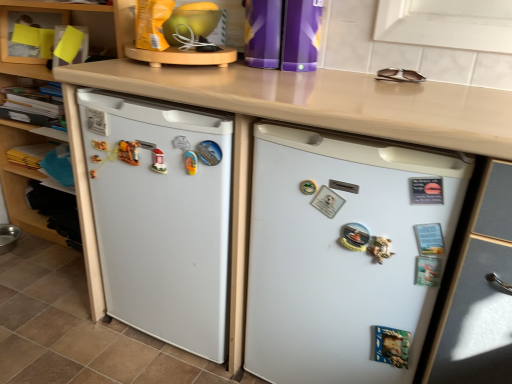
Measure the distance between point [12,194] and camera.

The distance of point [12,194] from camera is 6.34 feet.

Find the location of `white matte refrigerator at left`. white matte refrigerator at left is located at coordinates (20, 183).

The image size is (512, 384). What do you see at coordinates (20, 183) in the screenshot? I see `white matte refrigerator at left` at bounding box center [20, 183].

Locate an element on the screen. The image size is (512, 384). white matte refrigerator at center, which appears as the 2th refrigerator when viewed from the left is located at coordinates (344, 253).

Measure the distance from white matte refrigerator at left to yellow paper at upper left, arranged as the first shelf when viewed from the top.

white matte refrigerator at left and yellow paper at upper left, arranged as the first shelf when viewed from the top, are 6.97 inches apart.

Is white matte refrigerator at left positioned beyond the bounds of yellow paper at upper left, arranged as the first shelf when viewed from the top?

Yes, white matte refrigerator at left is not within yellow paper at upper left, arranged as the first shelf when viewed from the top.

What's the angular difference between white matte refrigerator at left and yellow paper at upper left, the 2th shelf ordered from the bottom,'s facing directions?

They differ by 23.4 degrees in their facing directions.

Is point (87, 254) closer to viewer compared to point (38, 58)?

Yes.

Can you tell me how much white matte refrigerator at left and wooden shelf at lower left, the 2th shelf from the top, differ in facing direction?

There is a 3.45-degree angle between the facing directions of white matte refrigerator at left and wooden shelf at lower left, the 2th shelf from the top.

Which is more to the right, white matte refrigerator at left or wooden shelf at lower left, the 2th shelf from the top?

Positioned to the right is white matte refrigerator at left.

Considering the relative positions of white matte refrigerator at left and wooden shelf at lower left, which is the first shelf in bottom-to-top order, in the image provided, is white matte refrigerator at left behind wooden shelf at lower left, which is the first shelf in bottom-to-top order,?

That is False.

Can you confirm if white matte refrigerator at left is thinner than wooden shelf at lower left, which is the first shelf in bottom-to-top order?

Incorrect, the width of white matte refrigerator at left is not less than that of wooden shelf at lower left, which is the first shelf in bottom-to-top order.

From a real-world perspective, does yellow paper at upper left, the 2th shelf ordered from the bottom, stand above white matte refrigerator at center, which appears as the 2th refrigerator when viewed from the left?

Indeed, from a real-world perspective, yellow paper at upper left, the 2th shelf ordered from the bottom, stands above white matte refrigerator at center, which appears as the 2th refrigerator when viewed from the left.

In the scene shown: Which of these two, yellow paper at upper left, arranged as the first shelf when viewed from the top, or white matte refrigerator at center, acting as the 1th refrigerator starting from the right, is smaller?

yellow paper at upper left, arranged as the first shelf when viewed from the top.

Can you confirm if yellow paper at upper left, the 2th shelf ordered from the bottom, is taller than white matte refrigerator at center, which appears as the 2th refrigerator when viewed from the left?

Incorrect, the height of yellow paper at upper left, the 2th shelf ordered from the bottom, is not larger of that of white matte refrigerator at center, which appears as the 2th refrigerator when viewed from the left.

Between white matte refrigerator at left, which is the second refrigerator from right to left, and wooden shelf at lower left, which is the first shelf in bottom-to-top order, which one has larger size?

white matte refrigerator at left, which is the second refrigerator from right to left.

How many degrees apart are the facing directions of white matte refrigerator at left, which ranks as the first refrigerator in left-to-right order, and wooden shelf at lower left, the 2th shelf from the top?

They differ by 3.32 degrees in their facing directions.

From a real-world perspective, which is physically above, white matte refrigerator at left, which ranks as the first refrigerator in left-to-right order, or wooden shelf at lower left, which is the first shelf in bottom-to-top order?

In real-world perspective, white matte refrigerator at left, which ranks as the first refrigerator in left-to-right order, is above.

Considering the positions of objects white matte refrigerator at left, which ranks as the first refrigerator in left-to-right order, and wooden shelf at lower left, the 2th shelf from the top, in the image provided, who is more to the left, white matte refrigerator at left, which ranks as the first refrigerator in left-to-right order, or wooden shelf at lower left, the 2th shelf from the top,?

wooden shelf at lower left, the 2th shelf from the top.

Is yellow paper at upper left, arranged as the first shelf when viewed from the top, positioned in front of wooden shelf at lower left, which is the first shelf in bottom-to-top order?

No, it is behind wooden shelf at lower left, which is the first shelf in bottom-to-top order.

From a real-world perspective, who is located lower, yellow paper at upper left, the 2th shelf ordered from the bottom, or wooden shelf at lower left, which is the first shelf in bottom-to-top order?

From a 3D spatial view, wooden shelf at lower left, which is the first shelf in bottom-to-top order, is below.

Is yellow paper at upper left, arranged as the first shelf when viewed from the top, oriented away from wooden shelf at lower left, which is the first shelf in bottom-to-top order?

No.

From the image's perspective, would you say yellow paper at upper left, arranged as the first shelf when viewed from the top, is shown under wooden shelf at lower left, the 2th shelf from the top?

Actually, yellow paper at upper left, arranged as the first shelf when viewed from the top, appears above wooden shelf at lower left, the 2th shelf from the top, in the image.

Is wooden shelf at lower left, which is the first shelf in bottom-to-top order, looking in the opposite direction of white matte refrigerator at left, which ranks as the first refrigerator in left-to-right order?

No.

Who is taller, wooden shelf at lower left, the 2th shelf from the top, or white matte refrigerator at left, which ranks as the first refrigerator in left-to-right order?

Standing taller between the two is white matte refrigerator at left, which ranks as the first refrigerator in left-to-right order.

From a real-world perspective, does wooden shelf at lower left, which is the first shelf in bottom-to-top order, stand above white matte refrigerator at left, which ranks as the first refrigerator in left-to-right order?

No, from a real-world perspective, wooden shelf at lower left, which is the first shelf in bottom-to-top order, is not over white matte refrigerator at left, which ranks as the first refrigerator in left-to-right order

Is wooden shelf at lower left, the 2th shelf from the top, positioned behind white matte refrigerator at left, which is the second refrigerator from right to left?

Yes, wooden shelf at lower left, the 2th shelf from the top, is further from the viewer.

Measure the distance between white matte refrigerator at center, acting as the 1th refrigerator starting from the right, and yellow paper at upper left, the 2th shelf ordered from the bottom.

They are 4.84 feet apart.

From a real-world perspective, is white matte refrigerator at center, acting as the 1th refrigerator starting from the right, above or below yellow paper at upper left, the 2th shelf ordered from the bottom?

From a real-world perspective, white matte refrigerator at center, acting as the 1th refrigerator starting from the right, is physically below yellow paper at upper left, the 2th shelf ordered from the bottom.

Who is shorter, white matte refrigerator at center, acting as the 1th refrigerator starting from the right, or yellow paper at upper left, the 2th shelf ordered from the bottom?

Standing shorter between the two is yellow paper at upper left, the 2th shelf ordered from the bottom.

Is point (278, 151) farther from viewer compared to point (6, 50)?

No, (278, 151) is closer to viewer.

Locate an element on the screen. shelf above the white matte refrigerator at left (from a real-world perspective) is located at coordinates (7, 31).

Identify the location of cabinetry that is in front of the wooden shelf at lower left, which is the first shelf in bottom-to-top order. The image size is (512, 384). (20, 183).

Looking at the image, which one is located closer to white matte refrigerator at center, acting as the 1th refrigerator starting from the right, yellow paper at upper left, arranged as the first shelf when viewed from the top, or wooden shelf at lower left, the 2th shelf from the top?

wooden shelf at lower left, the 2th shelf from the top, is closer to white matte refrigerator at center, acting as the 1th refrigerator starting from the right.

Looking at the image, which one is located further to wooden shelf at lower left, the 2th shelf from the top, white matte refrigerator at left or white matte refrigerator at center, acting as the 1th refrigerator starting from the right?

Among the two, white matte refrigerator at center, acting as the 1th refrigerator starting from the right, is located further to wooden shelf at lower left, the 2th shelf from the top.

Based on their spatial positions, is wooden shelf at lower left, the 2th shelf from the top, or white matte refrigerator at left, which ranks as the first refrigerator in left-to-right order, further from white matte refrigerator at center, acting as the 1th refrigerator starting from the right?

The object further to white matte refrigerator at center, acting as the 1th refrigerator starting from the right, is wooden shelf at lower left, the 2th shelf from the top.

Which object lies further to the anchor point white matte refrigerator at center, which appears as the 2th refrigerator when viewed from the left, white matte refrigerator at left, which is the second refrigerator from right to left, or yellow paper at upper left, the 2th shelf ordered from the bottom?

yellow paper at upper left, the 2th shelf ordered from the bottom, is further to white matte refrigerator at center, which appears as the 2th refrigerator when viewed from the left.

Estimate the real-world distances between objects in this image. Which object is closer to yellow paper at upper left, arranged as the first shelf when viewed from the top, wooden shelf at lower left, which is the first shelf in bottom-to-top order, or white matte refrigerator at center, acting as the 1th refrigerator starting from the right?

wooden shelf at lower left, which is the first shelf in bottom-to-top order, lies closer to yellow paper at upper left, arranged as the first shelf when viewed from the top, than the other object.

Based on their spatial positions, is white matte refrigerator at center, which appears as the 2th refrigerator when viewed from the left, or white matte refrigerator at left, which ranks as the first refrigerator in left-to-right order, closer to wooden shelf at lower left, which is the first shelf in bottom-to-top order?

Based on the image, white matte refrigerator at left, which ranks as the first refrigerator in left-to-right order, appears to be nearer to wooden shelf at lower left, which is the first shelf in bottom-to-top order.

When comparing their distances from white matte refrigerator at center, acting as the 1th refrigerator starting from the right, does yellow paper at upper left, arranged as the first shelf when viewed from the top, or white matte refrigerator at left, which is the second refrigerator from right to left, seem closer?

white matte refrigerator at left, which is the second refrigerator from right to left, is positioned closer to the anchor white matte refrigerator at center, acting as the 1th refrigerator starting from the right.

From the image, which object appears to be farther from white matte refrigerator at left, which is the second refrigerator from right to left, wooden shelf at lower left, the 2th shelf from the top, or yellow paper at upper left, arranged as the first shelf when viewed from the top?

Among the two, yellow paper at upper left, arranged as the first shelf when viewed from the top, is located further to white matte refrigerator at left, which is the second refrigerator from right to left.

You are a GUI agent. You are given a task and a screenshot of the screen. Output one action in this format:
    pyautogui.click(x=<x>, y=<y>)
    Task: Click on the cabinetry between wooden shelf at lower left, which is the first shelf in bottom-to-top order, and white matte refrigerator at center, which appears as the 2th refrigerator when viewed from the left
    The width and height of the screenshot is (512, 384).
    Given the screenshot: What is the action you would take?
    pyautogui.click(x=20, y=183)

You are a GUI agent. You are given a task and a screenshot of the screen. Output one action in this format:
    pyautogui.click(x=<x>, y=<y>)
    Task: Click on the refrigerator between white matte refrigerator at left and white matte refrigerator at center, acting as the 1th refrigerator starting from the right
    The width and height of the screenshot is (512, 384).
    Given the screenshot: What is the action you would take?
    pyautogui.click(x=162, y=216)

You are a GUI agent. You are given a task and a screenshot of the screen. Output one action in this format:
    pyautogui.click(x=<x>, y=<y>)
    Task: Click on the shelf between white matte refrigerator at left, which ranks as the first refrigerator in left-to-right order, and yellow paper at upper left, the 2th shelf ordered from the bottom, in the front-back direction
    This screenshot has width=512, height=384.
    Given the screenshot: What is the action you would take?
    pyautogui.click(x=25, y=203)

Identify the location of refrigerator between yellow paper at upper left, the 2th shelf ordered from the bottom, and white matte refrigerator at center, which appears as the 2th refrigerator when viewed from the left. The height and width of the screenshot is (384, 512). (162, 216).